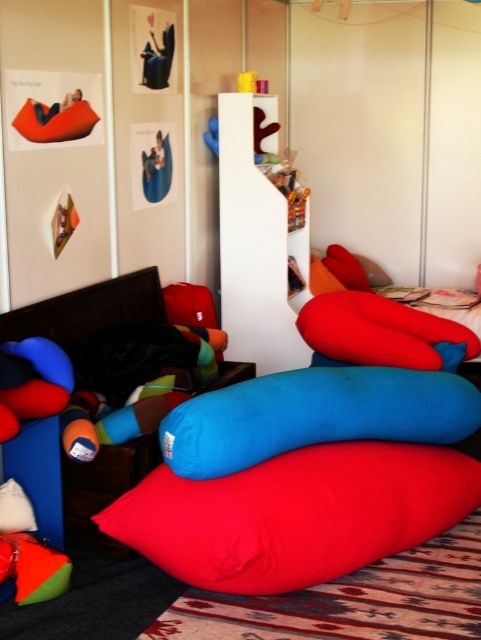
Does point (383, 529) come closer to viewer compared to point (455, 387)?

Yes, it is.

Between matte red beanbag at lower center and blue soft cushion at center, which one appears on the left side from the viewer's perspective?

Positioned to the left is matte red beanbag at lower center.

The image size is (481, 640). Identify the location of matte red beanbag at lower center. (295, 515).

Which is above, blue soft cushion at center or red soft cushion at center?

red soft cushion at center is above.

Is blue soft cushion at center behind red soft cushion at center?

No, blue soft cushion at center is in front of red soft cushion at center.

Where is `blue soft cushion at center`? Image resolution: width=481 pixels, height=640 pixels. blue soft cushion at center is located at coordinates (315, 416).

Is matte red beanbag at lower center shorter than red soft cushion at center?

Incorrect, matte red beanbag at lower center's height does not fall short of red soft cushion at center's.

Does point (352, 513) come in front of point (334, 324)?

Yes, point (352, 513) is in front of point (334, 324).

Identify the location of matte red beanbag at lower center. This screenshot has height=640, width=481. (295, 515).